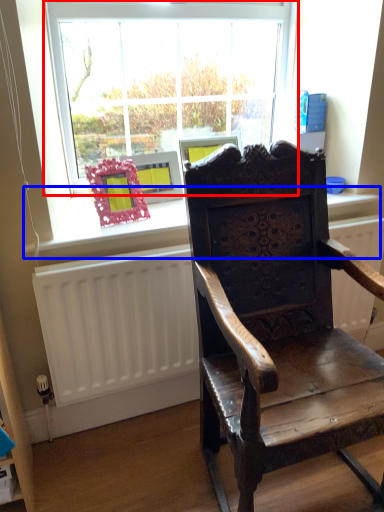
Question: Among these objects, which one is farthest to the camera, window (highlighted by a red box) or window sill (highlighted by a blue box)?

Choices:
 (A) window
 (B) window sill

Answer: (A)